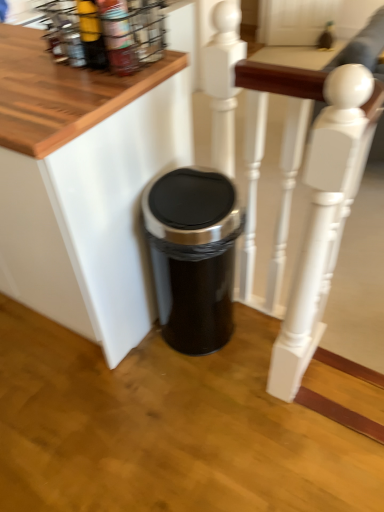
Question: From the image's perspective, is white painted wood at center located above matte yellow bottle at upper left?

Choices:
 (A) no
 (B) yes

Answer: (A)

Question: Does white painted wood at center come in front of matte yellow bottle at upper left?

Choices:
 (A) no
 (B) yes

Answer: (B)

Question: Is matte yellow bottle at upper left at the back of white painted wood at center?

Choices:
 (A) yes
 (B) no

Answer: (B)

Question: Considering the relative sizes of white painted wood at center and matte yellow bottle at upper left in the image provided, is white painted wood at center wider than matte yellow bottle at upper left?

Choices:
 (A) yes
 (B) no

Answer: (A)

Question: Does white painted wood at center have a lesser width compared to matte yellow bottle at upper left?

Choices:
 (A) yes
 (B) no

Answer: (B)

Question: Is white painted wood at center bigger than matte yellow bottle at upper left?

Choices:
 (A) no
 (B) yes

Answer: (B)

Question: Is metallic wire spice rack at upper left far away from black plastic trash can at lower center?

Choices:
 (A) no
 (B) yes

Answer: (A)

Question: Is black plastic trash can at lower center surrounded by metallic wire spice rack at upper left?

Choices:
 (A) yes
 (B) no

Answer: (B)

Question: Considering the relative sizes of metallic wire spice rack at upper left and black plastic trash can at lower center in the image provided, is metallic wire spice rack at upper left wider than black plastic trash can at lower center?

Choices:
 (A) yes
 (B) no

Answer: (B)

Question: Can you confirm if metallic wire spice rack at upper left is bigger than black plastic trash can at lower center?

Choices:
 (A) yes
 (B) no

Answer: (B)

Question: Is metallic wire spice rack at upper left closer to camera compared to black plastic trash can at lower center?

Choices:
 (A) yes
 (B) no

Answer: (B)

Question: Is the depth of metallic wire spice rack at upper left greater than that of black plastic trash can at lower center?

Choices:
 (A) yes
 (B) no

Answer: (A)

Question: Is matte yellow bottle at upper left smaller than black plastic trash can at lower center?

Choices:
 (A) yes
 (B) no

Answer: (A)